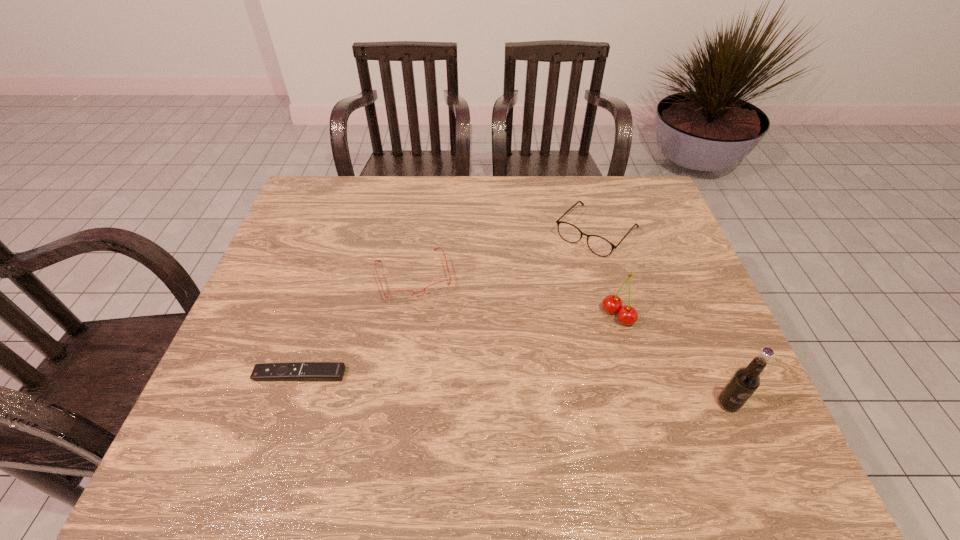
Identify the location of vacant space on the desktop that is between the shortest object and the nearest object and is positioned on the front-facing side of the taller spectacles. (463, 385).

Identify the location of vacant space on the desktop that is between the fourth farthest object and the tallest object and is positioned with the stems of the cherry pointing upwards. This screenshot has height=540, width=960. (529, 389).

Where is `vacant space on the desktop that is between the shortest object and the rightmost object and is positioned on the lenses of the left spectacles`? The image size is (960, 540). vacant space on the desktop that is between the shortest object and the rightmost object and is positioned on the lenses of the left spectacles is located at coordinates (446, 384).